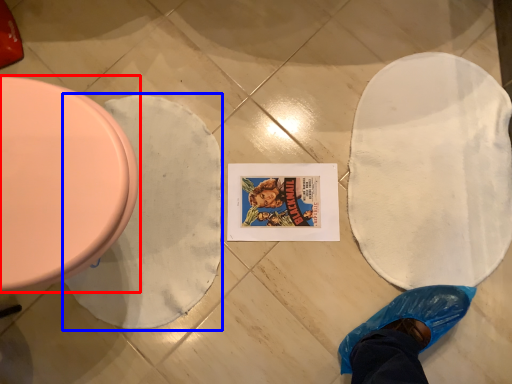
Question: Which of the following is the farthest to the observer, toilet (highlighted by a red box) or blanket (highlighted by a blue box)?

Choices:
 (A) toilet
 (B) blanket

Answer: (B)